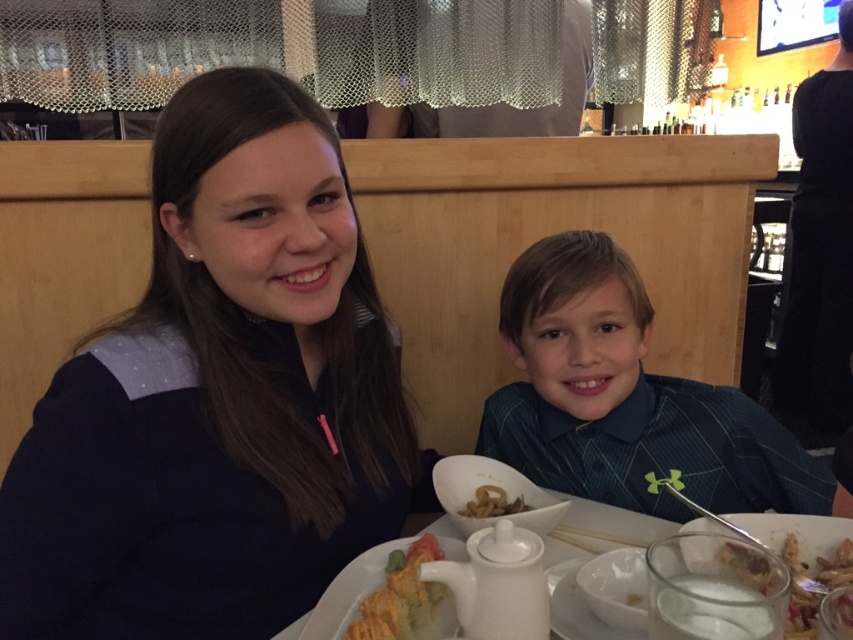
Question: Observing the image, what is the correct spatial positioning of navy blue sweater at upper left in reference to brown crispy onion at center?

Choices:
 (A) left
 (B) right

Answer: (A)

Question: Can you confirm if blue striped shirt at center is bigger than white creamy dessert at lower right?

Choices:
 (A) no
 (B) yes

Answer: (B)

Question: Can you confirm if blue striped shirt at center is smaller than white glossy teapot at lower center?

Choices:
 (A) yes
 (B) no

Answer: (B)

Question: Which point is closer to the camera?

Choices:
 (A) (151, 531)
 (B) (738, 534)
 (C) (491, 506)

Answer: (A)

Question: Which point is farther to the camera?

Choices:
 (A) white creamy dessert at lower right
 (B) blue striped shirt at center

Answer: (B)

Question: Which point is closer to the camera?

Choices:
 (A) brown crispy onion at center
 (B) blue striped shirt at center
 (C) white matte teapot at center
 (D) navy blue sweater at upper left

Answer: (C)